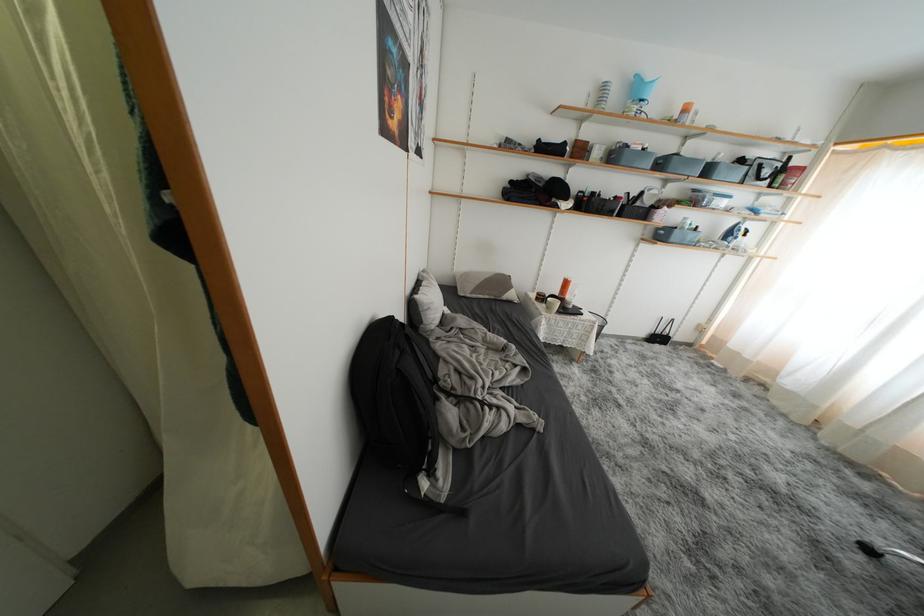
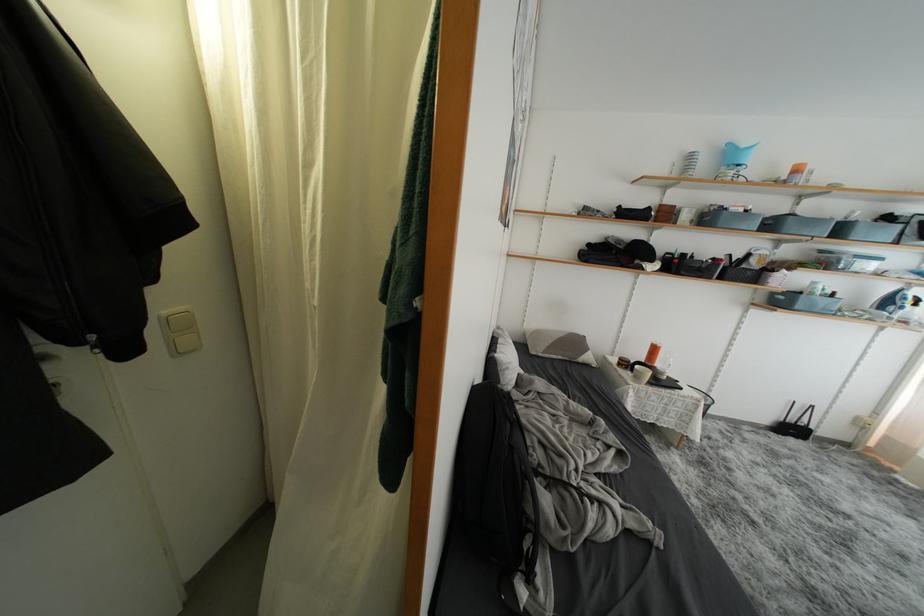
Find the pixel in the second image that matches (700,195) in the first image.

(829, 256)